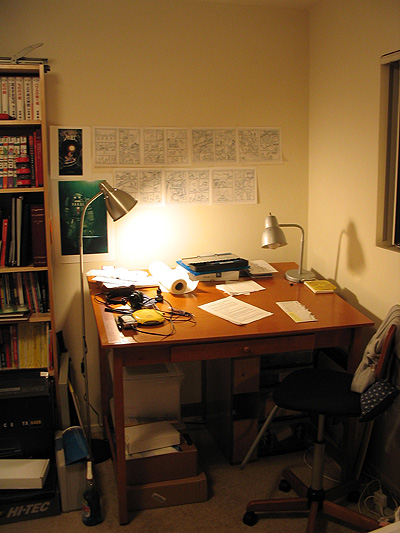
Identify the location of floor. The width and height of the screenshot is (400, 533). (185, 524).